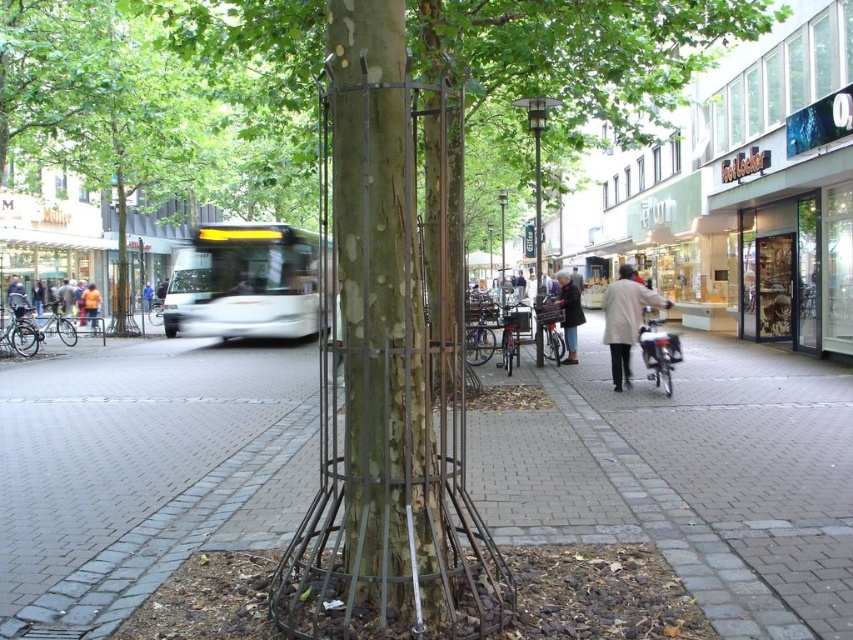
Between orange jacket at center and blue fabric jacket at center, which one appears on the left side from the viewer's perspective?

From the viewer's perspective, blue fabric jacket at center appears more on the left side.

What do you see at coordinates (90, 305) in the screenshot?
I see `orange jacket at center` at bounding box center [90, 305].

At what (x,y) coordinates should I click in order to perform the action: click on orange jacket at center. Please return your answer as a coordinate pair (x, y). This screenshot has height=640, width=853. Looking at the image, I should click on (90, 305).

Does point (616, 342) come in front of point (151, 300)?

Yes, point (616, 342) is in front of point (151, 300).

Is point (627, 296) positioned before point (148, 307)?

Yes, point (627, 296) is in front of point (148, 307).

The height and width of the screenshot is (640, 853). Identify the location of light beige coat at center. click(625, 320).

How much distance is there between metallic wire cage at center and orange jacket at center?

metallic wire cage at center is 26.15 meters away from orange jacket at center.

Which is behind, point (432, 541) or point (93, 292)?

The point (93, 292) is more distant.

Is point (370, 582) behind point (94, 310)?

No.

Where is `metallic wire cage at center`? metallic wire cage at center is located at coordinates (381, 323).